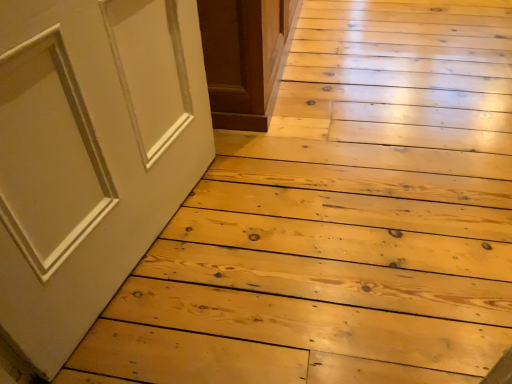
This screenshot has height=384, width=512. What are the coordinates of `vacant space to the right of white painted wood door at left` in the screenshot? It's located at (294, 241).